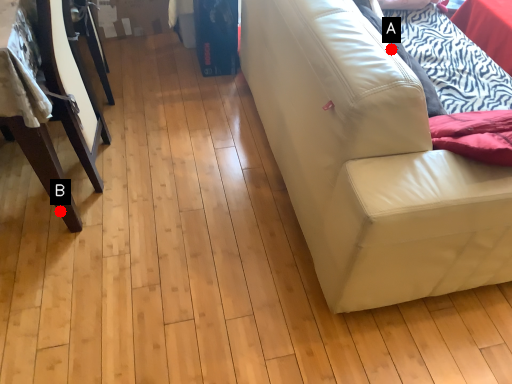
Question: Two points are circled on the image, labeled by A and B beside each circle. Among these points, which one is farthest from the camera?

Choices:
 (A) A is further
 (B) B is further

Answer: (B)